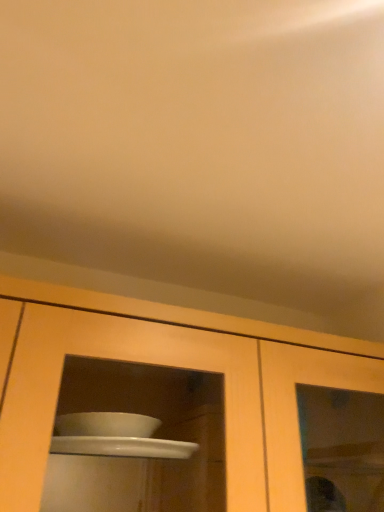
What do you see at coordinates (180, 367) in the screenshot?
I see `matte wood cabinet at center` at bounding box center [180, 367].

In order to click on matte wood cabinet at center in this screenshot , I will do `click(180, 367)`.

Where is `matte wood cabinet at center`? This screenshot has width=384, height=512. matte wood cabinet at center is located at coordinates (x=180, y=367).